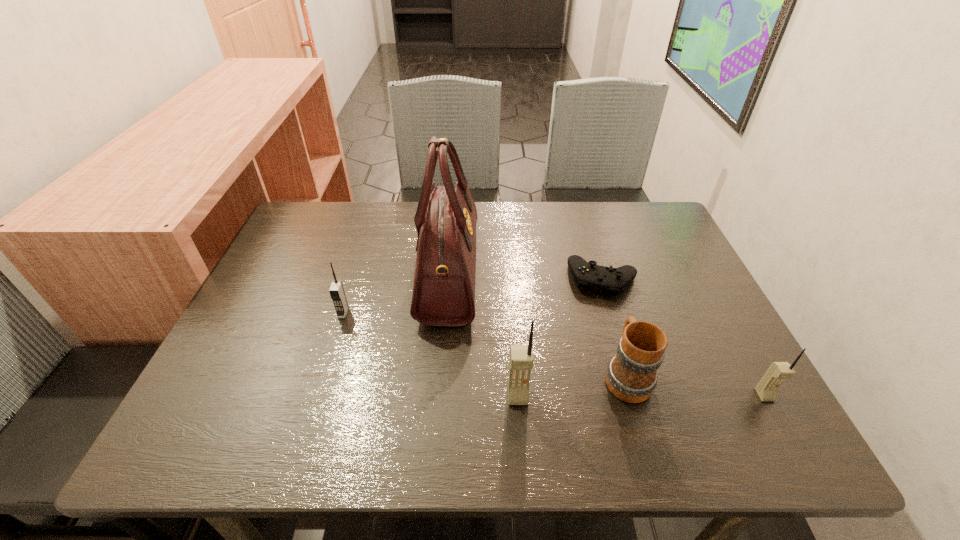
Find the location of a particular element. The image size is (960, 540). free region located on the left of the control is located at coordinates (483, 279).

Locate an element on the screen. vacant area situated on the front-facing side of the farthest cellular telephone is located at coordinates tap(336, 335).

Identify the location of free space located 0.140m on the side of the mug with the handle. (605, 303).

Find the location of `vacant space situated on the side of the mug with the handle`. vacant space situated on the side of the mug with the handle is located at coordinates pyautogui.click(x=590, y=254).

Locate an element on the screen. The image size is (960, 540). free space located on the side of the mug with the handle is located at coordinates (612, 328).

This screenshot has width=960, height=540. Identify the location of object that is at the far edge. (444, 282).

The image size is (960, 540). Identify the location of mug that is at the near edge. (631, 376).

At what (x,y) coordinates should I click in order to perform the action: click on cellular telephone that is at the right edge. Please return your answer as a coordinate pair (x, y). Looking at the image, I should click on (766, 389).

The image size is (960, 540). Find the location of `control that is at the right edge`. control that is at the right edge is located at coordinates (613, 281).

Image resolution: width=960 pixels, height=540 pixels. Identify the location of object present at the near right corner. (766, 389).